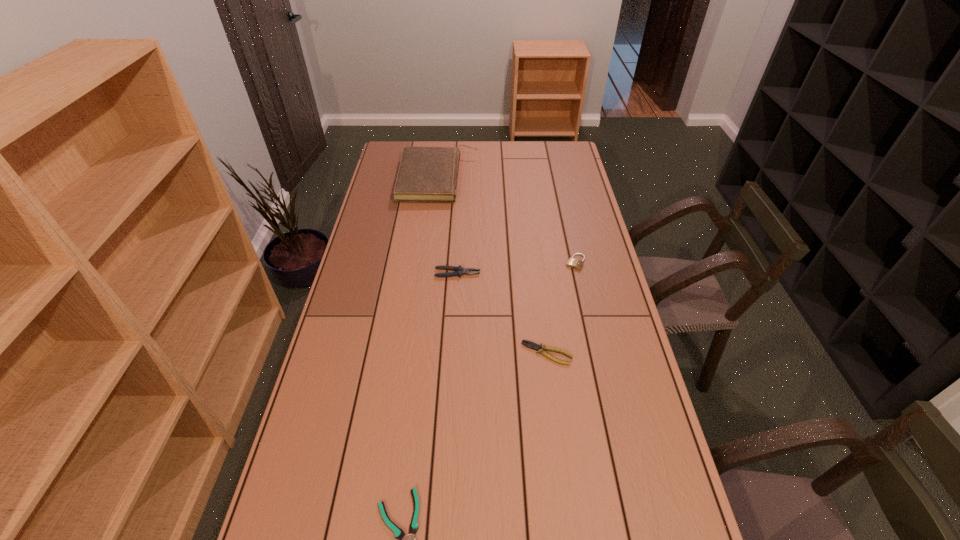
Where is `the tallest object`? the tallest object is located at coordinates (426, 174).

Image resolution: width=960 pixels, height=540 pixels. Identify the location of paperback book. (426, 174).

The image size is (960, 540). I want to click on the tallest pliers, so click(459, 271).

Locate an element on the screen. the farthest pliers is located at coordinates (459, 271).

Locate an element on the screen. padlock is located at coordinates (573, 263).

This screenshot has height=540, width=960. Identify the location of the second nearest object. (532, 345).

Identify the location of the second tallest pliers. Image resolution: width=960 pixels, height=540 pixels. (532, 345).

Image resolution: width=960 pixels, height=540 pixels. Identify the location of vacant position located 0.180m on the spine side of the paperback book. (518, 178).

You are a GUI agent. You are given a task and a screenshot of the screen. Output one action in this format:
    pyautogui.click(x=<x>, y=<y>)
    Task: Click on the vacant region located 0.100m at the gripping part of the tallest pliers
    This screenshot has width=960, height=540.
    Given the screenshot: What is the action you would take?
    pyautogui.click(x=508, y=273)

Find the location of a particular element. The width and height of the screenshot is (960, 540). blank space located on the right of the rightmost object is located at coordinates (605, 262).